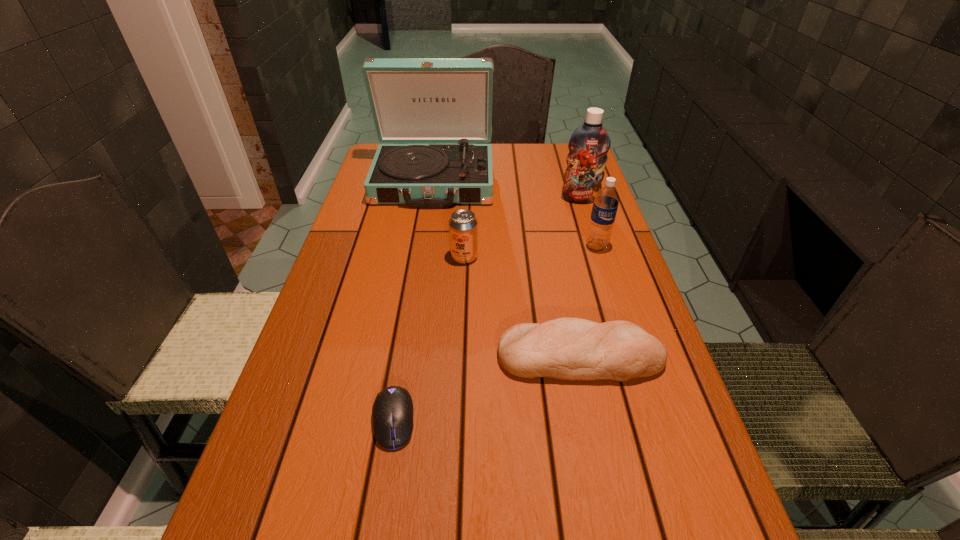
Locate an element on the screen. The image size is (960, 540). vacant region between the third tallest object and the shampoo is located at coordinates (588, 223).

Where is `vacant area between the third shortest object and the nearest object`? The height and width of the screenshot is (540, 960). vacant area between the third shortest object and the nearest object is located at coordinates (429, 339).

You are a GUI agent. You are given a task and a screenshot of the screen. Output one action in this format:
    pyautogui.click(x=<x>, y=<y>)
    Task: Click on the free point between the second nearest object and the nearest object
    
    Given the screenshot: What is the action you would take?
    pyautogui.click(x=487, y=388)

Where is `the fifth closest object to the fourth shortest object`? The image size is (960, 540). the fifth closest object to the fourth shortest object is located at coordinates (392, 412).

The height and width of the screenshot is (540, 960). What are the coordinates of `the fifth closest object to the water bottle` in the screenshot? It's located at (392, 412).

At what (x,y) coordinates should I click in order to perform the action: click on free space that satisfies the following two spatial constraints: 1. on the front label of the second tallest object; 2. on the right side of the third tallest object. Please return your answer as a coordinate pair (x, y). The image size is (960, 540). Looking at the image, I should click on (595, 247).

Find the location of a particular element. Image resolution: width=960 pixels, height=540 pixels. free location that satisfies the following two spatial constraints: 1. on the face side of the third shortest object; 2. on the right side of the record player is located at coordinates (422, 257).